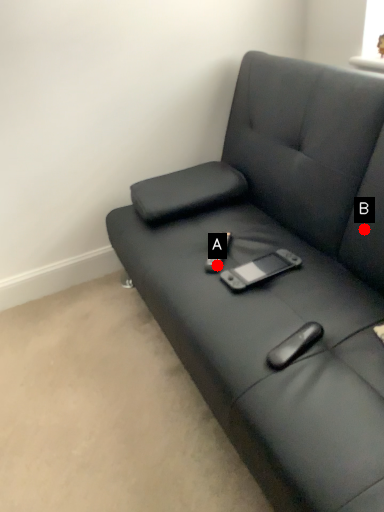
Question: Two points are circled on the image, labeled by A and B beside each circle. Which point is closer to the camera?

Choices:
 (A) A is closer
 (B) B is closer

Answer: (B)